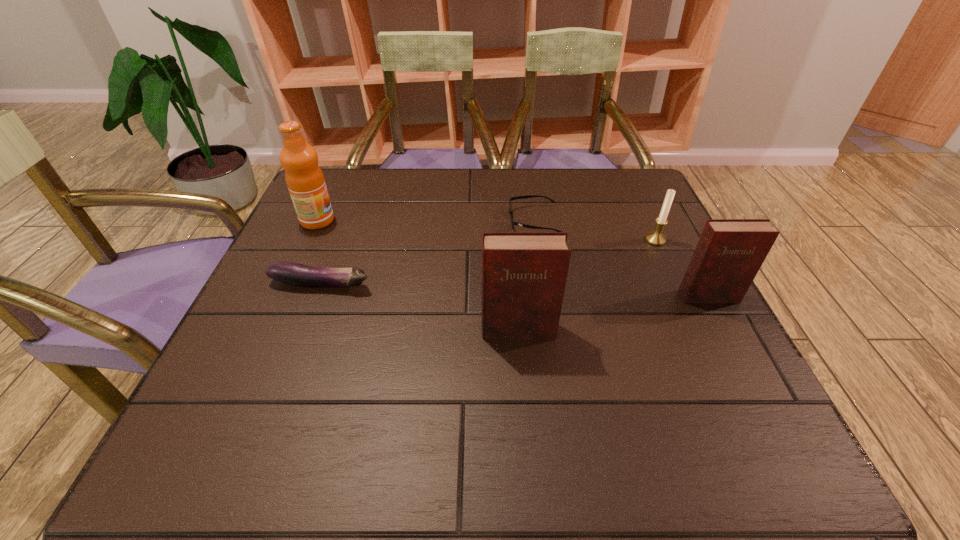
The height and width of the screenshot is (540, 960). Find the location of `vacant area that lies between the second shortest object and the fruit juice`. vacant area that lies between the second shortest object and the fruit juice is located at coordinates (319, 253).

Locate an element on the screen. The image size is (960, 540). free space that is in between the candle holder and the nearest object is located at coordinates (587, 285).

Locate an element on the screen. Image resolution: width=960 pixels, height=540 pixels. free space between the nearest object and the fruit juice is located at coordinates (418, 275).

In order to click on free space that is in between the fruit juice and the shortest object in this screenshot , I will do `click(425, 220)`.

Locate an element on the screen. blank region between the fifth tallest object and the nearest object is located at coordinates (420, 307).

You are a GUI agent. You are given a task and a screenshot of the screen. Output one action in this format:
    pyautogui.click(x=<x>, y=<y>)
    Task: Click on the empty space that is in between the fruit juice and the nearer diary
    This screenshot has width=960, height=540.
    Given the screenshot: What is the action you would take?
    pyautogui.click(x=418, y=275)

Identify which object is the fifth closest to the left diary. Please provide its 2D coordinates. Your answer should be formatted as a tuple, i.e. [(x, y)], where the tuple contains the x and y coordinates of a point satisfying the conditions above.

[(304, 178)]

Locate which object is the fifth closest to the candle holder. Please provide its 2D coordinates. Your answer should be formatted as a tuple, i.e. [(x, y)], where the tuple contains the x and y coordinates of a point satisfying the conditions above.

[(304, 178)]

Where is `vacant area in the image that satisfies the following two spatial constraints: 1. on the back side of the third shortest object; 2. on the front-facing side of the shortest object`? The width and height of the screenshot is (960, 540). vacant area in the image that satisfies the following two spatial constraints: 1. on the back side of the third shortest object; 2. on the front-facing side of the shortest object is located at coordinates 646,220.

Locate an element on the screen. free space that satisfies the following two spatial constraints: 1. on the label side of the fruit juice; 2. on the back side of the eggplant is located at coordinates (288, 284).